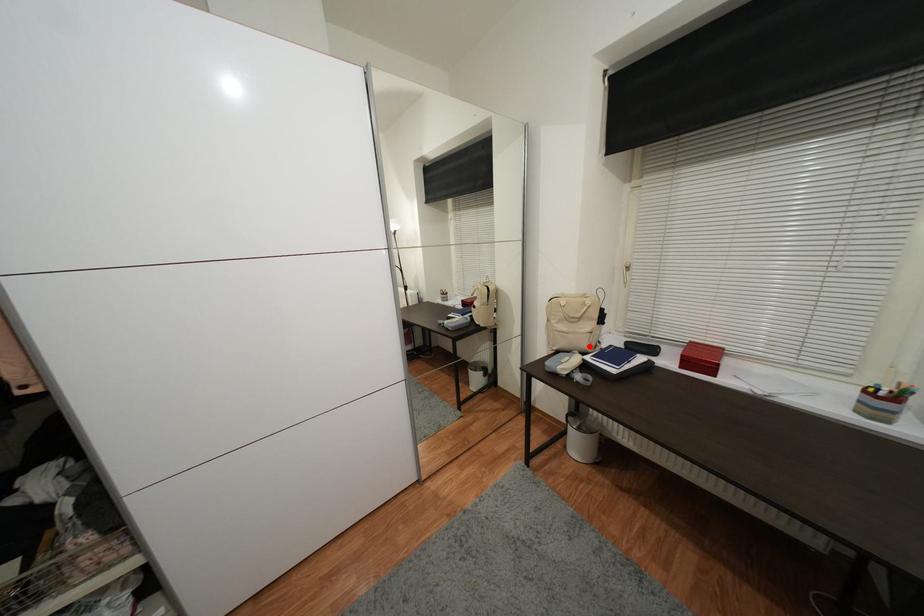
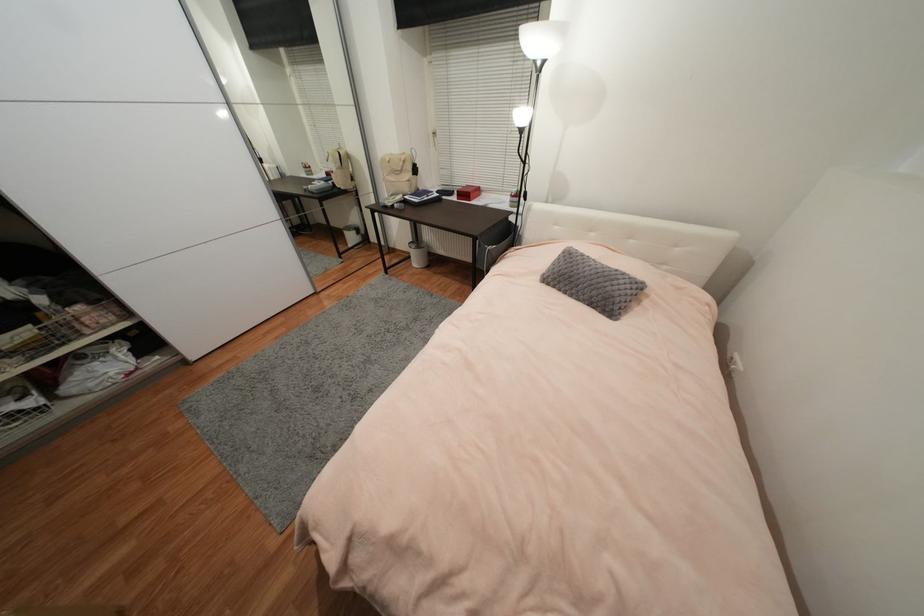
Question: I am providing you with two images of the same scene from different viewpoints. A red point is shown in image1. For the corresponding object point in image2, is it positioned nearer or farther from the camera?

Choices:
 (A) Nearer
 (B) Farther

Answer: (A)